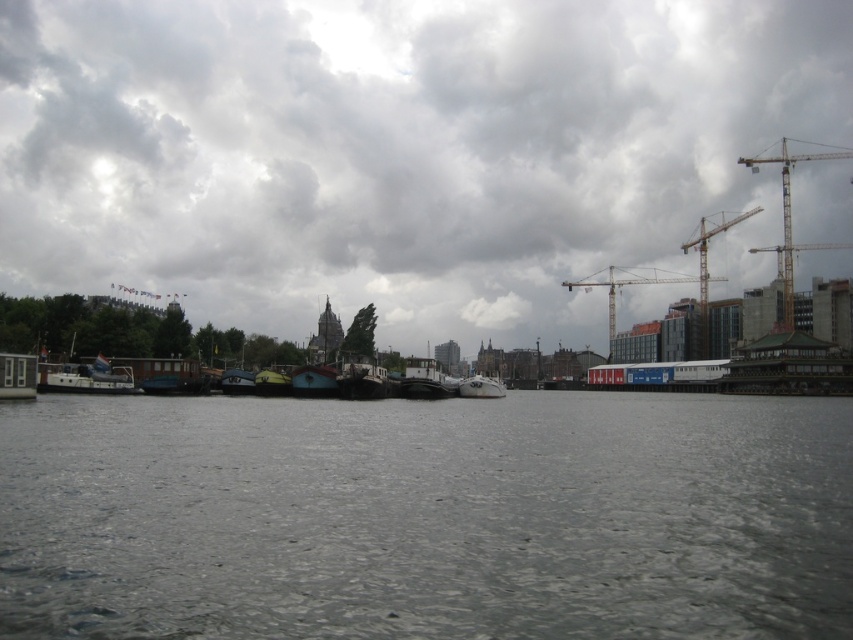
Question: Does metallic construction crane at upper right appear on the right side of white glossy door at left?

Choices:
 (A) yes
 (B) no

Answer: (A)

Question: Does teal glossy boat at center appear on the left side of white glossy boat at center?

Choices:
 (A) yes
 (B) no

Answer: (A)

Question: Which of the following is the farthest from the observer?

Choices:
 (A) metallic construction crane at upper right
 (B) yellow metallic crane at upper right
 (C) teal glossy boat at center

Answer: (A)

Question: Which object appears farthest from the camera in this image?

Choices:
 (A) metallic construction crane at upper right
 (B) teal glossy boat at center
 (C) gray water at center

Answer: (A)

Question: Estimate the real-world distances between objects in this image. Which object is farther from the white matte boat at center?

Choices:
 (A) teal glossy boat at center
 (B) metallic yellow crane at right
 (C) metallic construction crane at upper right

Answer: (C)

Question: Can you confirm if metallic yellow crane at right is wider than white glossy boat at center?

Choices:
 (A) no
 (B) yes

Answer: (B)